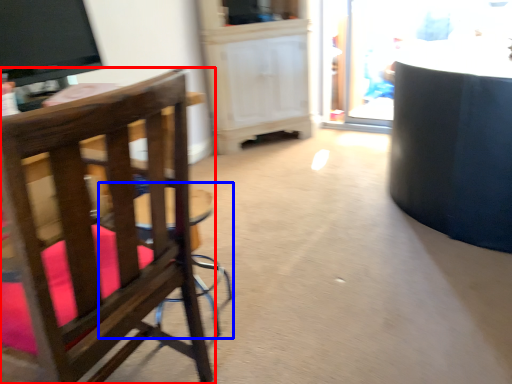
Question: Among these objects, which one is farthest to the camera, chair (highlighted by a red box) or bar stool (highlighted by a blue box)?

Choices:
 (A) chair
 (B) bar stool

Answer: (B)